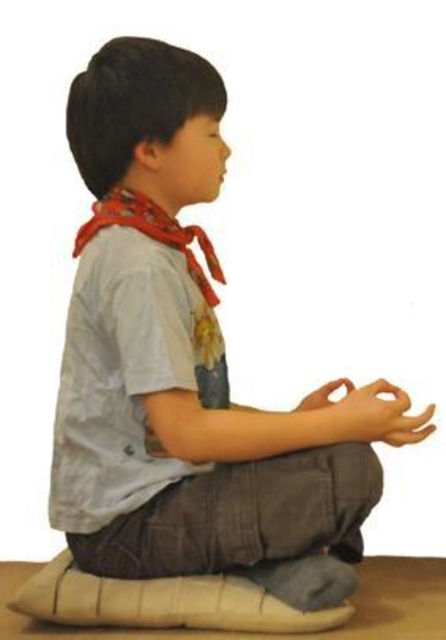
You are a photographer adjusting your camera settings to capture the subject in the scene. You notice two points marked in the image at coordinates point [133,225] and point [349,422]. Which point is closer to your camera lens?

Point [133,225] is further to the viewer than point [349,422], so the point closer to the camera lens would be point [133,225].

You are a photographer adjusting your camera settings to capture the scene. You want to focus on the red cotton scarf at upper left and the smooth tan hand at lower right. Which object should you adjust your focus to first if you want to ensure both are in focus, given their positions relative to the viewer?

The red cotton scarf at upper left is further to the viewer than the smooth tan hand at lower right. To ensure both are in focus, you should focus on the red cotton scarf at upper left first, as it is closer, and the depth of field will naturally include the hand behind it.

You are a photographer setting up a shoot in this scene. You need to ensure that the red cotton scarf at upper left and the smooth tan hand at lower right are both visible in the frame. Based on their positions and sizes, which object should you prioritize keeping centered to maintain balance in the composition?

The red cotton scarf at upper left is much taller than the smooth tan hand at lower right, so prioritizing the red cotton scarf at upper left in the center will help maintain balance due to its larger size.